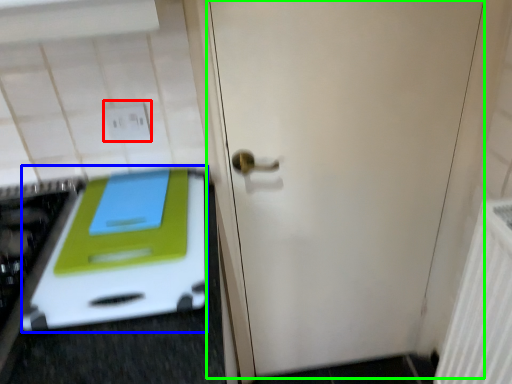
Question: Estimate the real-world distances between objects in this image. Which object is farther from electric outlet (highlighted by a red box), oven (highlighted by a blue box) or door (highlighted by a green box)?

Choices:
 (A) oven
 (B) door

Answer: (B)